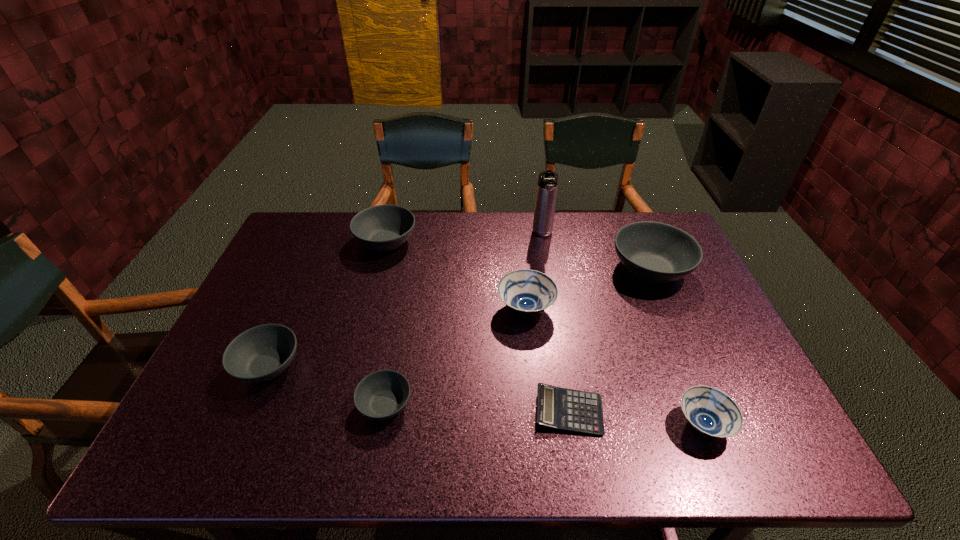
What are the coordinates of `vacant area located 0.160m on the right of the shortest object` in the screenshot? It's located at (674, 411).

What are the coordinates of `thermos bottle present at the far edge` in the screenshot? It's located at (547, 184).

Where is `calculator located in the near edge section of the desktop`? This screenshot has height=540, width=960. calculator located in the near edge section of the desktop is located at coordinates (559, 408).

Find the location of a particular element. The width and height of the screenshot is (960, 540). object at the left edge is located at coordinates (261, 353).

I want to click on object at the far right corner, so click(x=657, y=253).

Locate an element on the screen. object situated at the near right corner is located at coordinates (x=711, y=412).

Where is `vacant space at the far edge of the desktop`? The image size is (960, 540). vacant space at the far edge of the desktop is located at coordinates pyautogui.click(x=558, y=225).

In the image, there is a desktop. At what (x,y) coordinates should I click in order to perform the action: click on vacant space at the near edge. Please return your answer as a coordinate pair (x, y). The height and width of the screenshot is (540, 960). Looking at the image, I should click on (646, 433).

Where is `free space at the left edge of the desktop`? free space at the left edge of the desktop is located at coordinates (273, 275).

Where is `free space at the right edge of the desktop`? The height and width of the screenshot is (540, 960). free space at the right edge of the desktop is located at coordinates (758, 393).